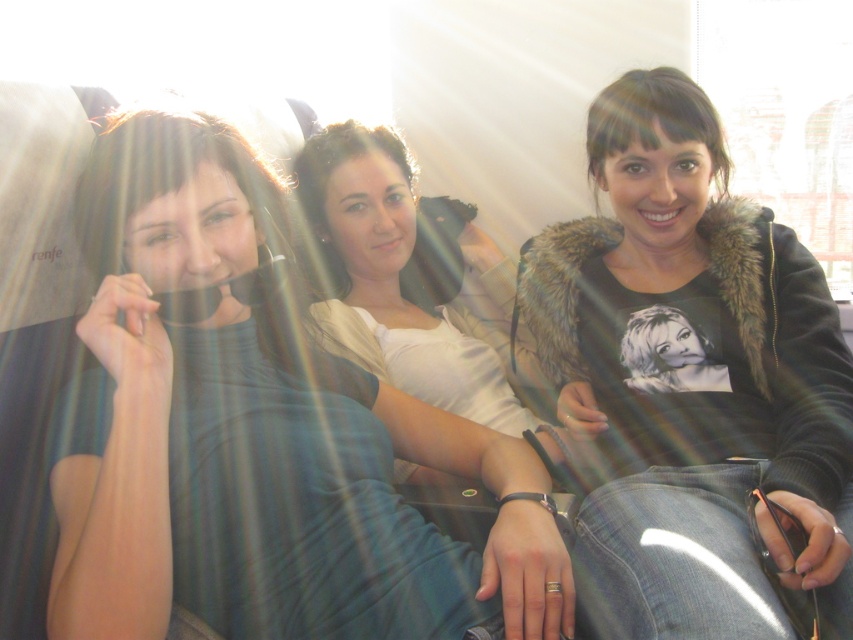
Is matte black shirt at left wider than white satin shirt at center?

Indeed, matte black shirt at left has a greater width compared to white satin shirt at center.

Which is in front, point (380, 540) or point (442, 227)?

Positioned in front is point (380, 540).

Locate an element on the screen. Image resolution: width=853 pixels, height=640 pixels. matte black shirt at left is located at coordinates (258, 433).

Describe the element at coordinates (258, 433) in the screenshot. This screenshot has height=640, width=853. I see `matte black shirt at left` at that location.

Does point (141, 285) come closer to viewer compared to point (820, 566)?

Yes, point (141, 285) is closer to viewer.

Locate an element on the screen. This screenshot has height=640, width=853. matte black shirt at left is located at coordinates (258, 433).

Does point (738, 538) come in front of point (476, 339)?

Yes, it is in front of point (476, 339).

Locate an element on the screen. This screenshot has width=853, height=640. fuzzy black jacket at center is located at coordinates (691, 381).